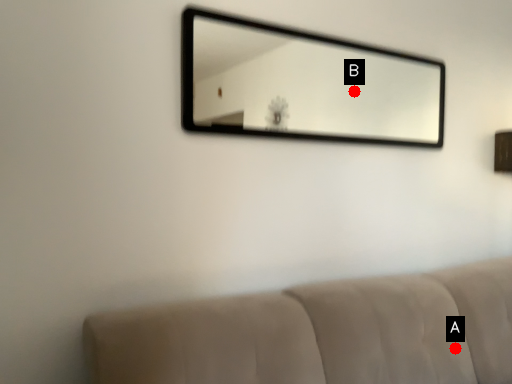
Question: Two points are circled on the image, labeled by A and B beside each circle. Which point appears closest to the camera in this image?

Choices:
 (A) A is closer
 (B) B is closer

Answer: (A)